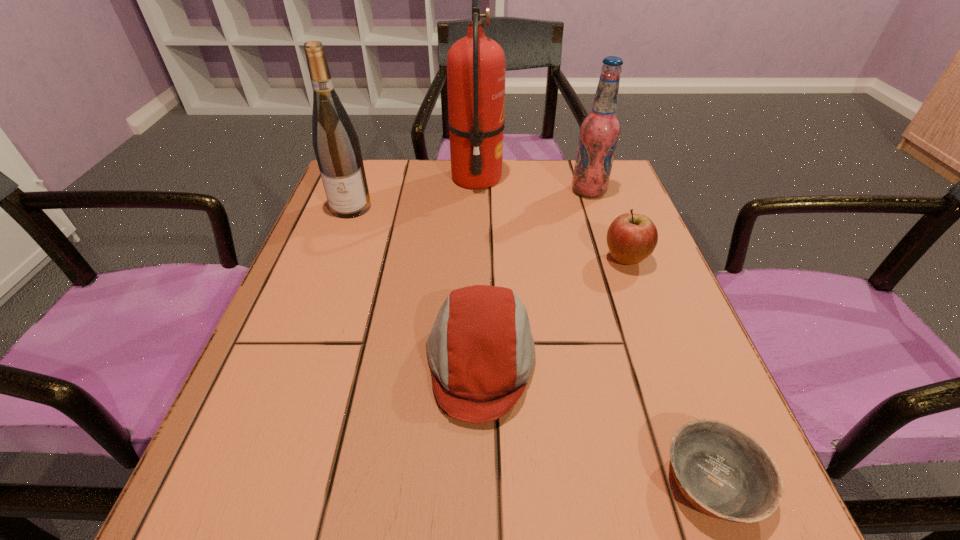
Locate an element on the screen. vacant area located 0.370m on the front of the apple is located at coordinates (698, 456).

At what (x,y) coordinates should I click in order to perform the action: click on free space located 0.100m on the front-facing side of the cap. Please return your answer as a coordinate pair (x, y). This screenshot has height=540, width=960. Looking at the image, I should click on (364, 362).

This screenshot has width=960, height=540. I want to click on vacant region located 0.200m on the front-facing side of the cap, so click(x=303, y=362).

Image resolution: width=960 pixels, height=540 pixels. What are the coordinates of `vacant region located on the front-facing side of the cap` in the screenshot? It's located at (316, 362).

Where is `free space located 0.170m on the back of the nearest object`? Image resolution: width=960 pixels, height=540 pixels. free space located 0.170m on the back of the nearest object is located at coordinates 660,342.

At what (x,y) coordinates should I click in order to perform the action: click on fire extinguisher present at the far edge. Please return your answer as a coordinate pair (x, y). This screenshot has width=960, height=540. Looking at the image, I should click on (475, 63).

Identify the location of wine bottle located at the far edge. (336, 145).

Find the location of `alcohol that is at the far edge`. alcohol that is at the far edge is located at coordinates (599, 131).

Locate an element on the screen. The width and height of the screenshot is (960, 540). object that is positioned at the near edge is located at coordinates click(721, 470).

You are a GUI agent. You are given a task and a screenshot of the screen. Output one action in this format:
    pyautogui.click(x=<x>, y=<y>)
    Task: Click on the object that is at the left edge
    
    Given the screenshot: What is the action you would take?
    pyautogui.click(x=336, y=145)